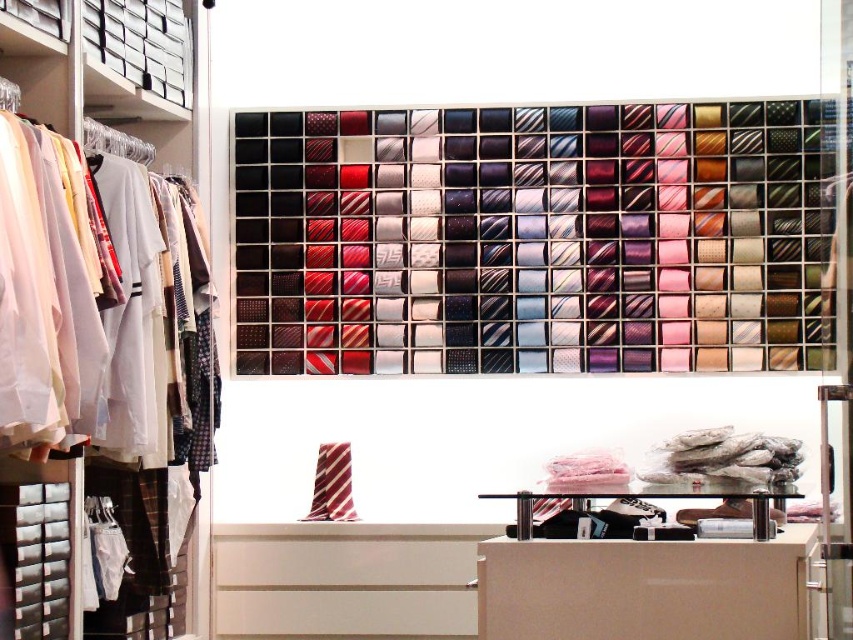
Is point (511, 259) farther from viewer compared to point (86, 65)?

Yes.

Does silky woven ties at upper center appear on the right side of matte white shirts at left?

Yes, silky woven ties at upper center is to the right of matte white shirts at left.

Is point (820, 164) more distant than point (26, 88)?

Yes, it is behind point (26, 88).

Identify the location of silky woven ties at upper center. tap(535, 237).

Between matte white shirts at left and striped fabric tie at center, which one is positioned lower?

striped fabric tie at center

Can you confirm if matte white shirts at left is smaller than striped fabric tie at center?

No.

Between point (15, 33) and point (322, 490), which one is positioned behind?

Point (322, 490)

Where is `matte white shirts at left`? Image resolution: width=853 pixels, height=640 pixels. matte white shirts at left is located at coordinates click(115, 92).

Is silky woven ties at upper center thinner than striped fabric tie at center?

No, silky woven ties at upper center is not thinner than striped fabric tie at center.

Does silky woven ties at upper center appear on the left side of striped fabric tie at center?

No, silky woven ties at upper center is not to the left of striped fabric tie at center.

Does point (238, 170) come farther from viewer compared to point (343, 483)?

Yes, it is.

Where is `silky woven ties at upper center`? silky woven ties at upper center is located at coordinates (535, 237).